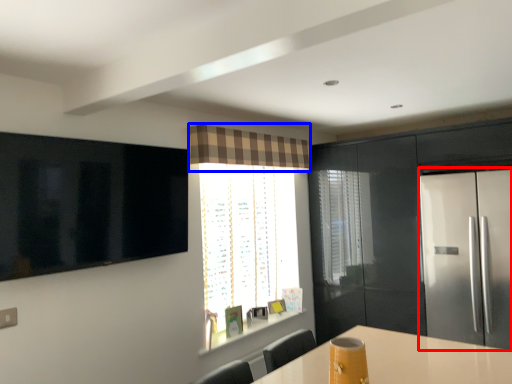
Question: Among these objects, which one is farthest to the camera, fridge (highlighted by a red box) or curtain (highlighted by a blue box)?

Choices:
 (A) fridge
 (B) curtain

Answer: (B)